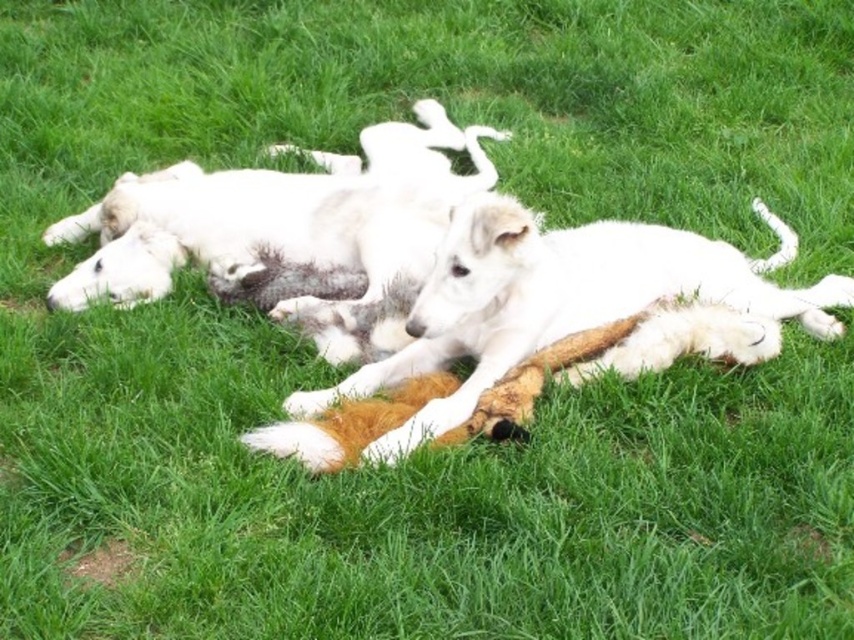
You are a photographer trying to capture a photo of both dogs in the scene. The camera you are using has a maximum focus range of 25 inches. Can you fit both the white fur dog at center and the white fluffy dog at center into the frame without moving the camera?

The distance between the white fur dog at center and the white fluffy dog at center is 27.38 inches, which exceeds the camera maximum focus range of 25 inches. Therefore, you cannot fit both dogs into the frame without moving the camera.

You are a photographer aiming to capture a photo of both the white fur dog at center and the white fluffy dog at center. Since you want them to be clearly visible in the photo, which dog should you focus on first to ensure it appears sharp and in focus?

The white fur dog at center is below white fluffy dog at center, so you should focus on the white fluffy dog at center first as it is closer to the camera.